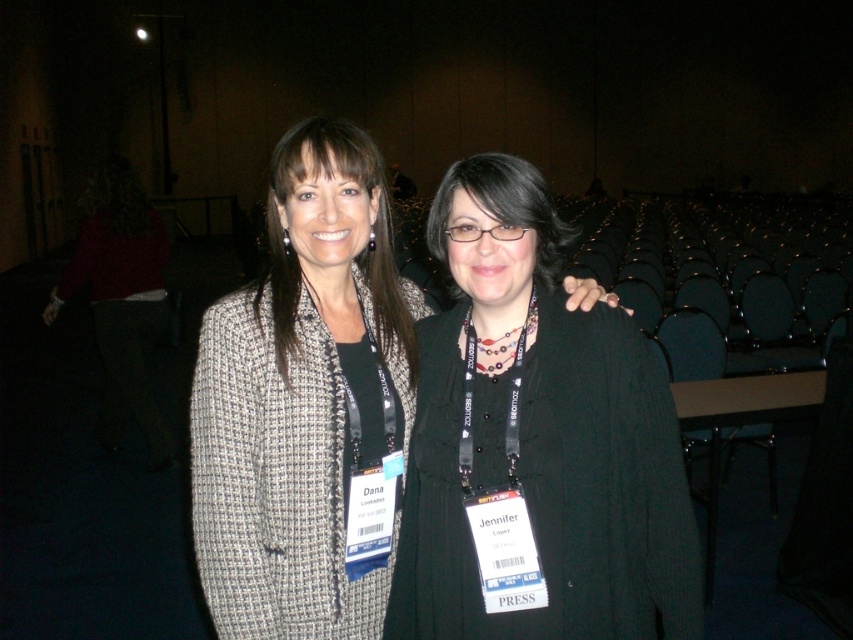
Which of these two, black matte jacket at center or matte gray blazer at center, stands taller?

With more height is matte gray blazer at center.

Is black matte jacket at center further to camera compared to matte gray blazer at center?

No, black matte jacket at center is in front of matte gray blazer at center.

Locate an element on the screen. The height and width of the screenshot is (640, 853). black matte jacket at center is located at coordinates (537, 442).

The image size is (853, 640). In order to click on black matte jacket at center in this screenshot , I will do `click(537, 442)`.